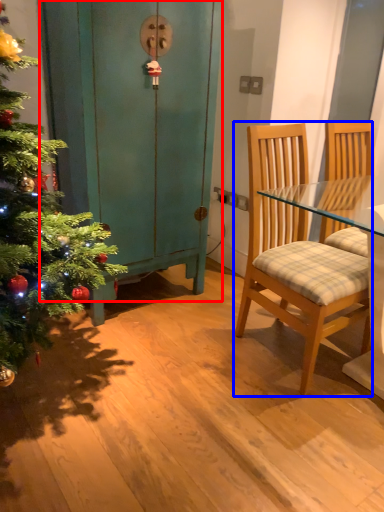
Question: Which object is further to the camera taking this photo, dresser (highlighted by a red box) or chair (highlighted by a blue box)?

Choices:
 (A) dresser
 (B) chair

Answer: (A)